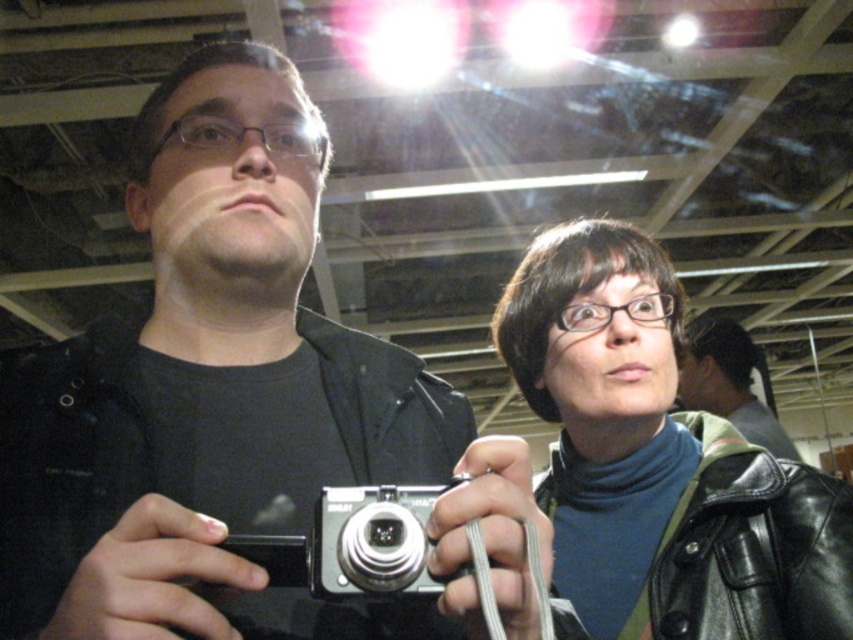
Is black leather jacket at upper right below silver metallic camera at center?

Correct, black leather jacket at upper right is located below silver metallic camera at center.

Does black leather jacket at upper right have a greater height compared to silver metallic camera at center?

Indeed, black leather jacket at upper right has a greater height compared to silver metallic camera at center.

Which is in front, point (635, 486) or point (386, 497)?

Point (386, 497) is in front.

Where is `black leather jacket at upper right`? The width and height of the screenshot is (853, 640). black leather jacket at upper right is located at coordinates (659, 461).